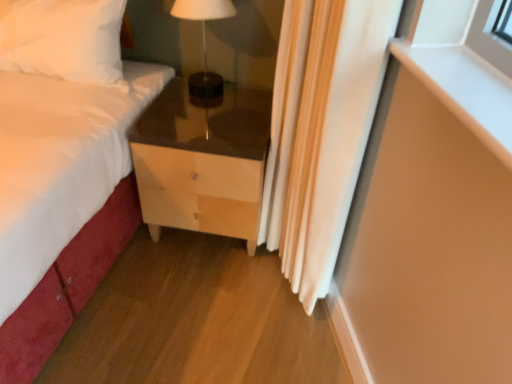
This screenshot has height=384, width=512. In order to click on vacant space to the left of matte brown table lamp at center in this screenshot , I will do `click(164, 89)`.